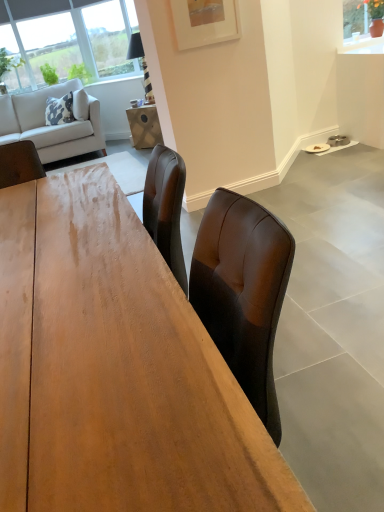
Locate an element on the screen. free location above wooden table at center (from a real-world perspective) is located at coordinates point(69,267).